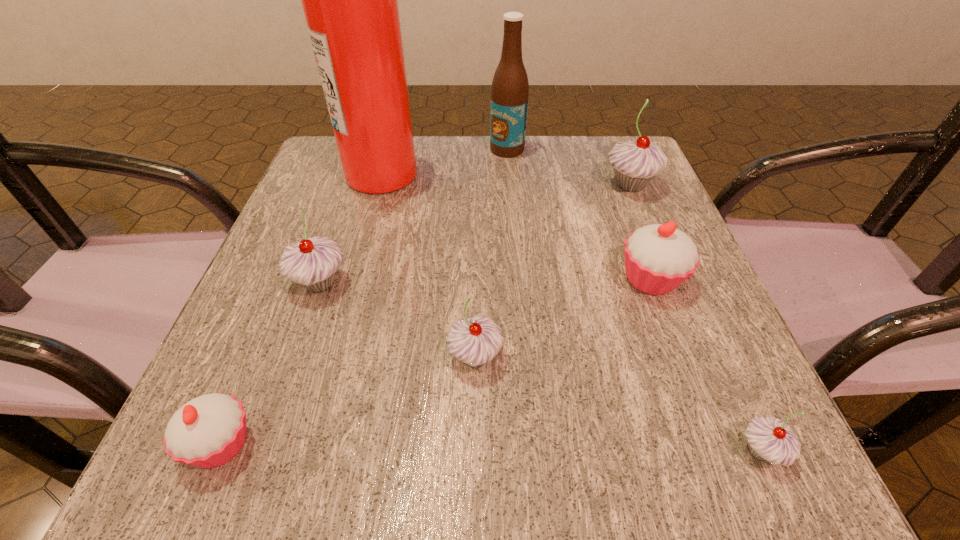
Find the location of a particular element. This screenshot has height=540, width=960. vacant area between the third smallest gray cupcake and the second smallest gray cupcake is located at coordinates (397, 320).

What are the coordinates of `empty space that is in between the beer bottle and the bigger pink cupcake` in the screenshot? It's located at pyautogui.click(x=579, y=214).

Find the location of `vacant space in between the third biggest gray cupcake and the bigger pink cupcake`. vacant space in between the third biggest gray cupcake and the bigger pink cupcake is located at coordinates (564, 318).

I want to click on free space between the third smallest gray cupcake and the farthest gray cupcake, so click(475, 234).

The image size is (960, 540). I want to click on free space between the second gray cupcake from left to right and the right pink cupcake, so click(564, 318).

This screenshot has height=540, width=960. What are the coordinates of `the third closest object to the left pink cupcake` in the screenshot? It's located at (350, 0).

The height and width of the screenshot is (540, 960). What are the coordinates of `object that stands as the closest to the nearer pink cupcake` in the screenshot? It's located at [313, 263].

Identify the location of cupcake that can be found as the second closest to the farther pink cupcake. (770, 439).

Where is `cupcake that stands as the fourth closest to the left pink cupcake`? cupcake that stands as the fourth closest to the left pink cupcake is located at coordinates (770, 439).

I want to click on gray cupcake that is the second nearest to the farther pink cupcake, so click(770, 439).